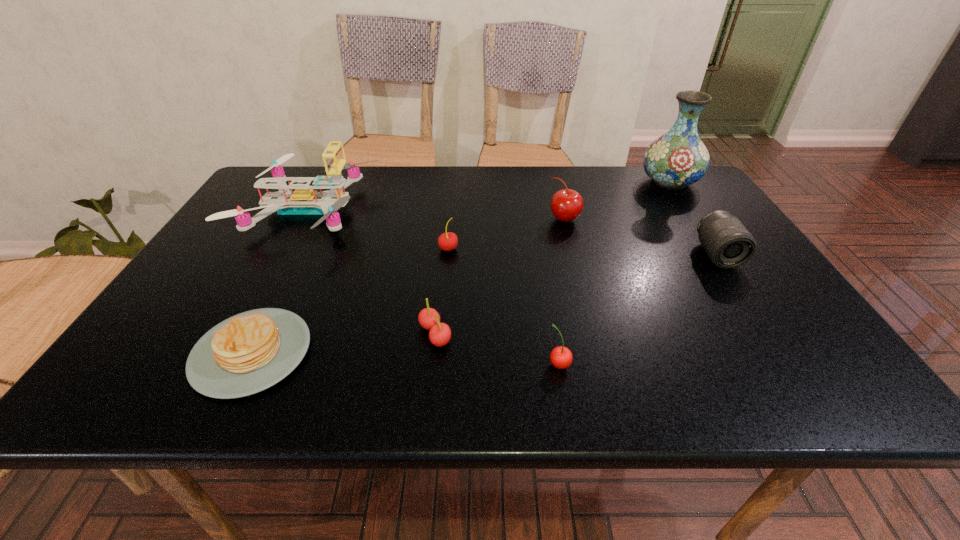
Find the location of `vacant space at the near edge of the desktop`. vacant space at the near edge of the desktop is located at coordinates (438, 371).

Where is `free space at the left edge of the desktop`? free space at the left edge of the desktop is located at coordinates (220, 297).

In the image, there is a desktop. Identify the location of vacant space at the right edge. The width and height of the screenshot is (960, 540). (724, 291).

In the image, there is a desktop. Where is `free space at the near left corner`? Image resolution: width=960 pixels, height=540 pixels. free space at the near left corner is located at coordinates (172, 373).

This screenshot has height=540, width=960. In order to click on vacant point at the far right corner in this screenshot , I will do `click(702, 188)`.

This screenshot has height=540, width=960. In the image, there is a desktop. Find the location of `vacant space at the near right corner`. vacant space at the near right corner is located at coordinates (806, 372).

The width and height of the screenshot is (960, 540). Identify the location of free space between the second farthest cherry and the fourth object from right to left. (504, 306).

I want to click on free spot between the seventh shortest object and the vase, so click(x=489, y=196).

This screenshot has width=960, height=540. I want to click on unoccupied position between the tallest object and the telephoto lens, so click(693, 218).

At what (x,y) coordinates should I click in order to perform the action: click on free point between the nearest cherry and the pancake. Please return your answer as a coordinate pair (x, y). The width and height of the screenshot is (960, 540). Looking at the image, I should click on (406, 359).